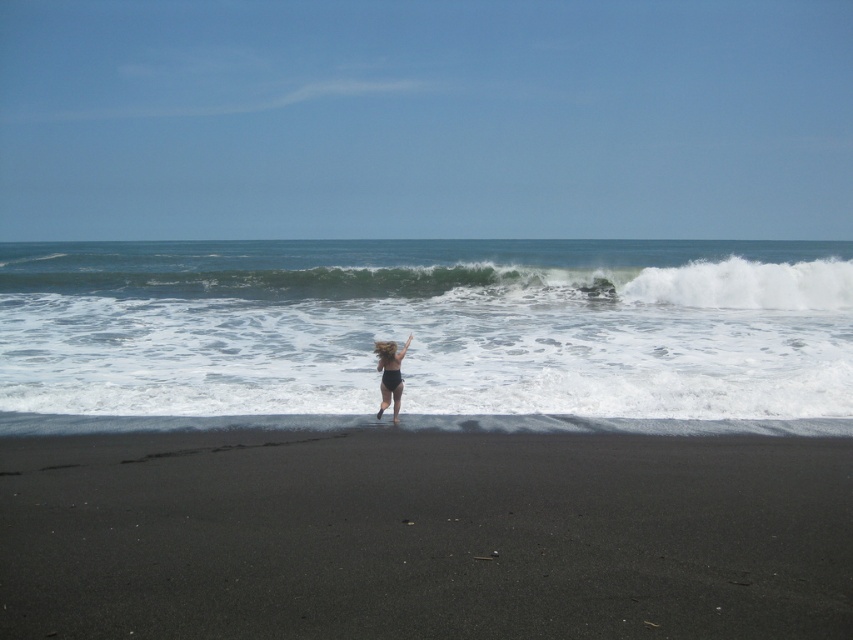
Consider the image. You are a photographer trying to capture the woman in the black matte swimsuit at center while avoiding the white frothy wave at upper center. Based on their positions, can you position yourself so the wave doesn not block the view of the swimsuit?

The white frothy wave at upper center is above the black matte swimsuit at center, so positioning yourself lower or adjusting your angle to look upwards might allow you to capture the swimsuit without the wave blocking it.

You are standing on the beach and see the white frothy wave at upper center and the black matte swimsuit at center. Which object is closer to you?

The white frothy wave at upper center is closer to you because the black matte swimsuit at center is behind it.

From the picture: You are standing on the beach and see the black sand at lower center and the white frothy wave at center. Which object is positioned to the right side of the other?

The black sand at lower center is to the right of the white frothy wave at center.